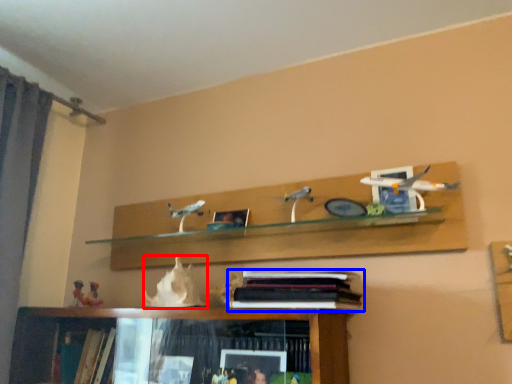
Question: Which of the following is the closest to the observer, animal (highlighted by a red box) or book (highlighted by a blue box)?

Choices:
 (A) animal
 (B) book

Answer: (B)